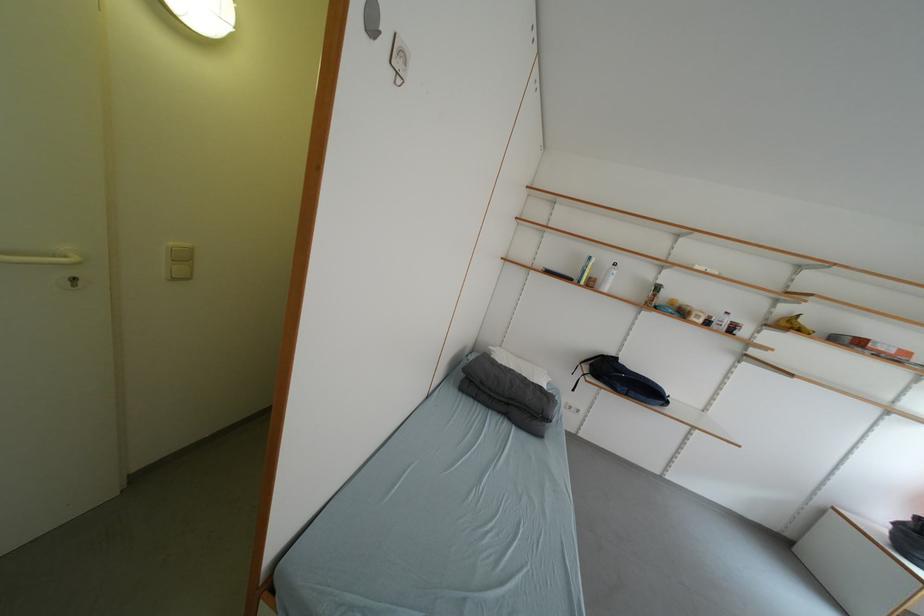
Find where to pull the white door handle. Please return your answer as a coordinate pair (x, y).

(43, 257)